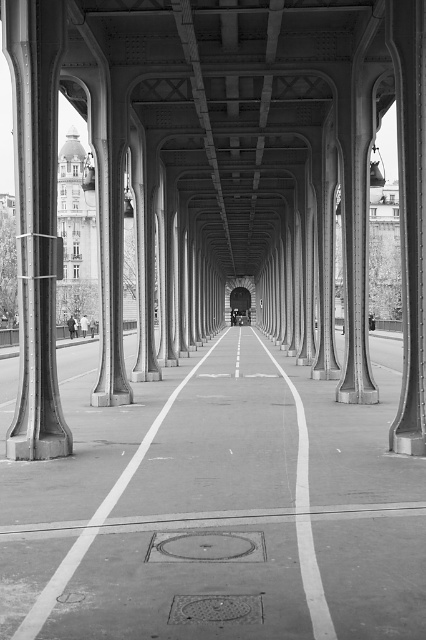
Question: Is smooth concrete line at center bigger than white glossy line at center?

Choices:
 (A) no
 (B) yes

Answer: (A)

Question: Does smooth concrete line at center have a larger size compared to white concrete line at center?

Choices:
 (A) yes
 (B) no

Answer: (B)

Question: Estimate the real-world distances between objects in this image. Which object is closer to the smooth concrete line at center?

Choices:
 (A) white glossy line at center
 (B) white concrete line at center

Answer: (B)

Question: Which point appears closest to the camera in this image?

Choices:
 (A) (239, 344)
 (B) (322, 596)

Answer: (B)

Question: Considering the real-world distances, which object is closest to the white concrete line at center?

Choices:
 (A) white glossy line at center
 (B) smooth concrete line at center

Answer: (B)

Question: Can you confirm if smooth concrete line at center is positioned below white glossy line at center?

Choices:
 (A) yes
 (B) no

Answer: (A)